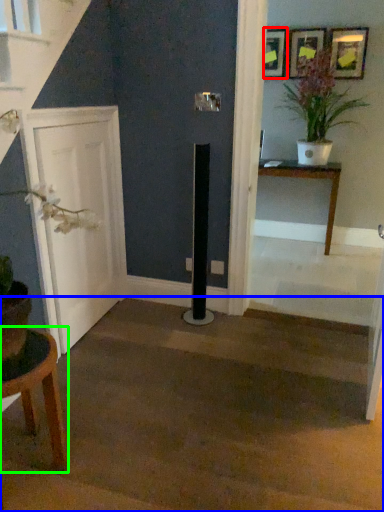
Question: Which is farther away from picture frame (highlighted by a red box)? stairwell (highlighted by a blue box) or table (highlighted by a green box)?

Choices:
 (A) stairwell
 (B) table

Answer: (B)